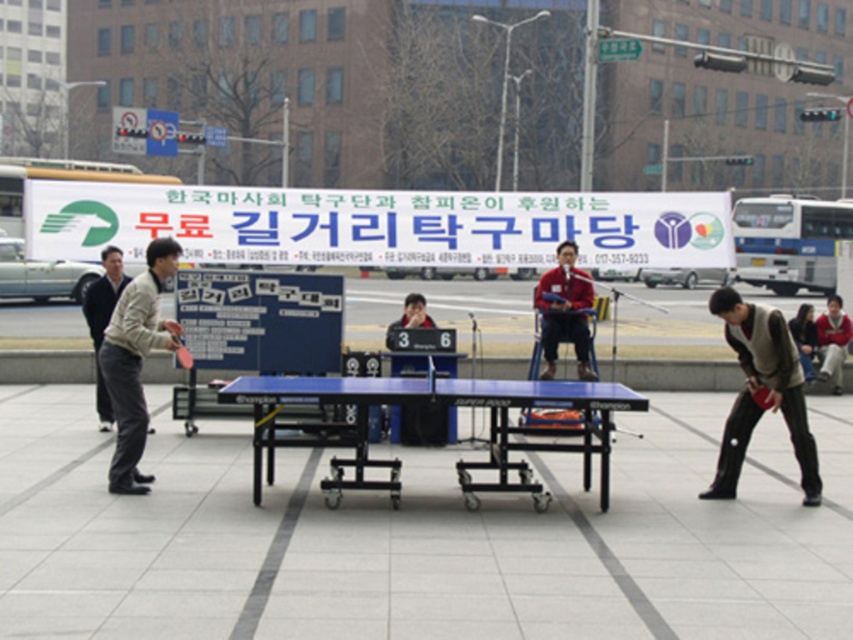
Question: Among these objects, which one is farthest from the camera?

Choices:
 (A) light beige jacket at left
 (B) red matte jacket at center

Answer: (B)

Question: Does dark brown leather vest at lower right appear on the left side of red sweater at center?

Choices:
 (A) no
 (B) yes

Answer: (B)

Question: Which point is farther from the camera taking this photo?

Choices:
 (A) pyautogui.click(x=737, y=349)
 (B) pyautogui.click(x=805, y=339)
 (C) pyautogui.click(x=141, y=339)

Answer: (B)

Question: Can you confirm if dark brown leather vest at lower right is smaller than dark brown leather jacket at lower right?

Choices:
 (A) yes
 (B) no

Answer: (A)

Question: From the image, what is the correct spatial relationship of red sweater at center in relation to dark brown leather jacket at lower right?

Choices:
 (A) below
 (B) above

Answer: (B)

Question: Which of the following is the farthest from the observer?

Choices:
 (A) red jacket at center
 (B) blue rubber table at center
 (C) red matte jacket at center
 (D) dark brown leather jacket at lower right

Answer: (D)